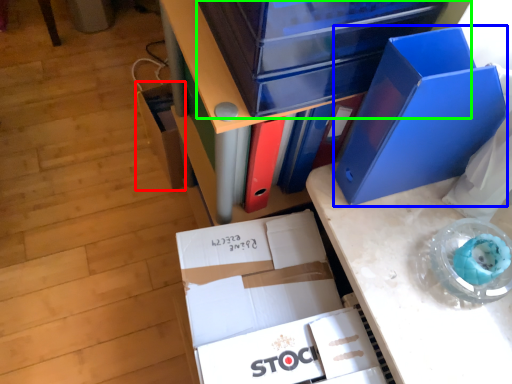
Question: Based on their relative distances, which object is nearer to storage box (highlighted by a red box)? Choose from paperback book (highlighted by a blue box) and storage box (highlighted by a green box).

Choices:
 (A) paperback book
 (B) storage box

Answer: (B)